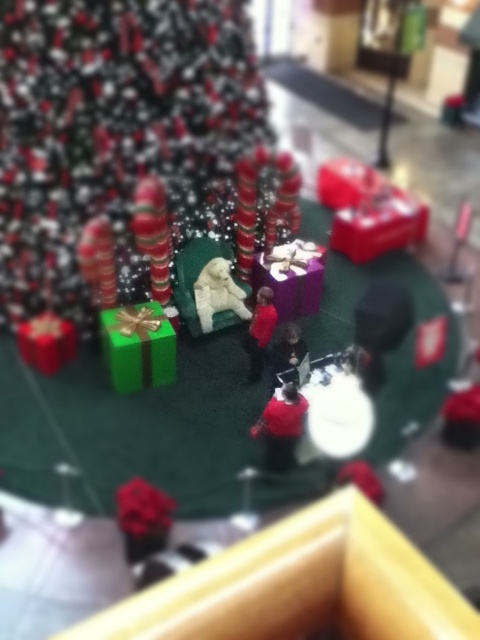
Does shiny metallic tree at center have a lesser width compared to fluffy white dog at center?

No.

Does point (180, 115) come closer to viewer compared to point (213, 276)?

Yes, it is in front of point (213, 276).

What do you see at coordinates (115, 132) in the screenshot? I see `shiny metallic tree at center` at bounding box center [115, 132].

At what (x,y) coordinates should I click in order to perform the action: click on shiny metallic tree at center. Please return your answer as a coordinate pair (x, y). The width and height of the screenshot is (480, 640). Looking at the image, I should click on (115, 132).

Is shiny metallic tree at center to the left of green matte gift at center from the viewer's perspective?

Correct, you'll find shiny metallic tree at center to the left of green matte gift at center.

I want to click on shiny metallic tree at center, so click(115, 132).

Between point (106, 145) and point (111, 333), which one is positioned behind?

Positioned behind is point (111, 333).

Where is `shiny metallic tree at center`? This screenshot has width=480, height=640. shiny metallic tree at center is located at coordinates (115, 132).

Can you confirm if green matte gift at center is bigger than shiny metallic candy cane at center?

Yes, green matte gift at center is bigger than shiny metallic candy cane at center.

Which is more to the left, green matte gift at center or shiny metallic candy cane at center?

green matte gift at center

Is point (139, 323) farther from camera compared to point (142, 209)?

That is True.

Where is `green matte gift at center`? The height and width of the screenshot is (640, 480). green matte gift at center is located at coordinates (137, 346).